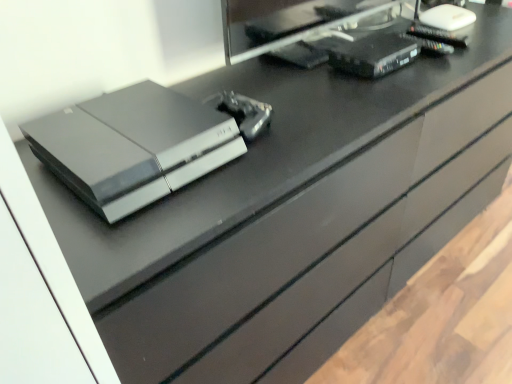
Identify the location of free space above satin black console at center (from a real-world perspective). The height and width of the screenshot is (384, 512). (132, 126).